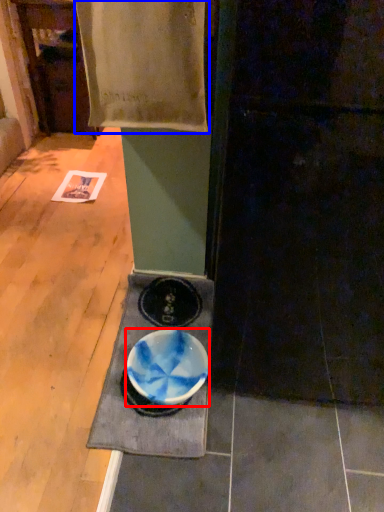
Question: Among these objects, which one is farthest to the camera, bowl (highlighted by a red box) or blanket (highlighted by a blue box)?

Choices:
 (A) bowl
 (B) blanket

Answer: (A)